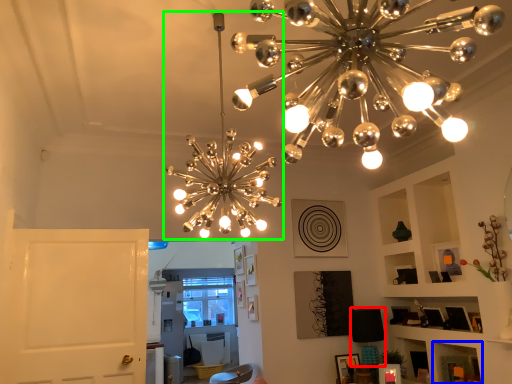
Question: Which object is positioned closest to lamp (highlighted by a red box)? Select from shelf (highlighted by a blue box) and lamp (highlighted by a green box).

Choices:
 (A) shelf
 (B) lamp

Answer: (A)